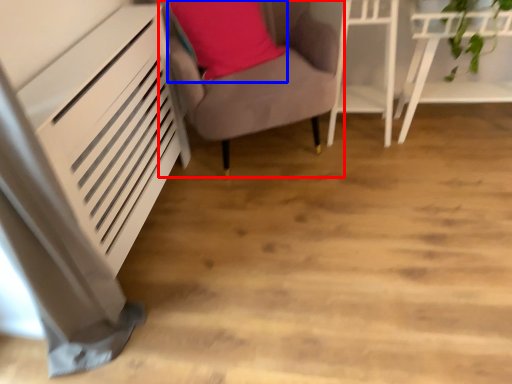
Question: Which of the following is the closest to the observer, furniture (highlighted by a red box) or pillow (highlighted by a blue box)?

Choices:
 (A) furniture
 (B) pillow

Answer: (A)